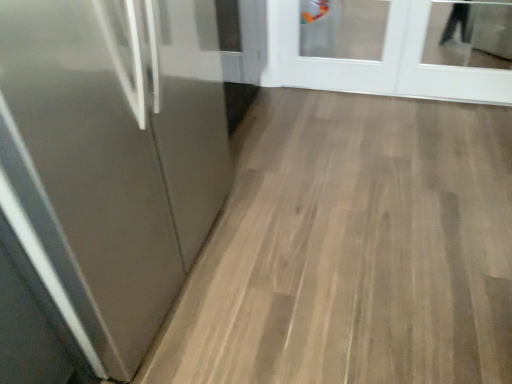
Question: Does white glossy door at upper right, the 2th door when ordered from front to back, have a lesser width compared to glossy metallic door at left, which ranks as the first door in front-to-back order?

Choices:
 (A) yes
 (B) no

Answer: (A)

Question: Is the position of white glossy door at upper right, the second door positioned from the left, more distant than that of glossy metallic door at left, the 2th door positioned from the right?

Choices:
 (A) no
 (B) yes

Answer: (B)

Question: Can you confirm if white glossy door at upper right, the second door positioned from the left, is bigger than glossy metallic door at left, which ranks as the first door in front-to-back order?

Choices:
 (A) yes
 (B) no

Answer: (B)

Question: Could you tell me if white glossy door at upper right, the 2th door when ordered from front to back, is facing glossy metallic door at left, placed as the 1th door when sorted from left to right?

Choices:
 (A) no
 (B) yes

Answer: (B)

Question: Can you confirm if white glossy door at upper right, which appears as the 1th door when viewed from the back, is smaller than glossy metallic door at left, which ranks as the first door in front-to-back order?

Choices:
 (A) no
 (B) yes

Answer: (B)

Question: Is white glossy door at upper right, the second door positioned from the left, positioned before glossy metallic door at left, which ranks as the first door in front-to-back order?

Choices:
 (A) no
 (B) yes

Answer: (A)

Question: Would you say glossy metallic door at left, the 2th door positioned from the right, contains white glossy door at upper right, which appears as the first door when viewed from the right?

Choices:
 (A) no
 (B) yes

Answer: (A)

Question: Can you confirm if glossy metallic door at left, placed as the 1th door when sorted from left to right, is taller than white glossy door at upper right, which appears as the first door when viewed from the right?

Choices:
 (A) yes
 (B) no

Answer: (A)

Question: Can we say glossy metallic door at left, which ranks as the first door in front-to-back order, lies outside white glossy door at upper right, the 2th door when ordered from front to back?

Choices:
 (A) yes
 (B) no

Answer: (A)

Question: Is the surface of glossy metallic door at left, the 2th door positioned from the right, in direct contact with white glossy door at upper right, the second door positioned from the left?

Choices:
 (A) yes
 (B) no

Answer: (B)

Question: Is glossy metallic door at left, the 2th door positioned from the right, shorter than white glossy door at upper right, the second door positioned from the left?

Choices:
 (A) yes
 (B) no

Answer: (B)

Question: Is glossy metallic door at left, which is the 2th door in back-to-front order, bigger than white glossy door at upper right, the second door positioned from the left?

Choices:
 (A) no
 (B) yes

Answer: (B)

Question: Based on their positions, is glossy metallic door at left, the 2th door positioned from the right, located to the left or right of white glossy door at upper right, which appears as the first door when viewed from the right?

Choices:
 (A) right
 (B) left

Answer: (B)